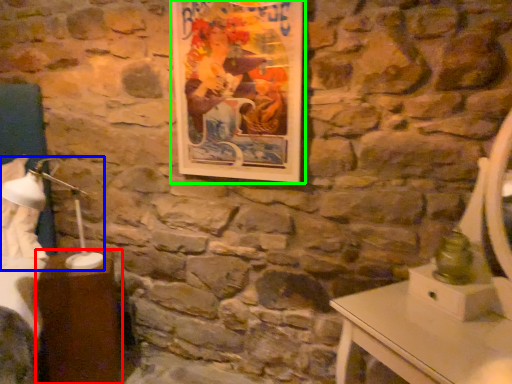
Question: Which is nearer to the table (highlighted by a red box)? bedside lamp (highlighted by a blue box) or picture frame (highlighted by a green box).

Choices:
 (A) bedside lamp
 (B) picture frame

Answer: (A)